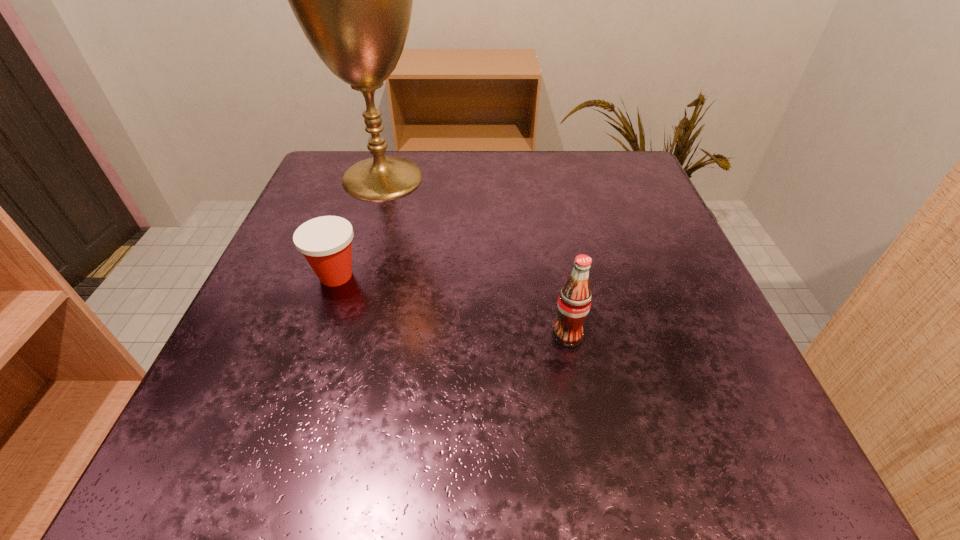
Find the location of `empty space between the farthest object and the soda`. empty space between the farthest object and the soda is located at coordinates (475, 256).

Identify the location of unoccupied position between the second tallest object and the trophy cup. (475, 256).

This screenshot has height=540, width=960. What are the coordinates of `vacant point located between the Dixie cup and the nearest object` in the screenshot? It's located at pyautogui.click(x=451, y=306).

Locate an element on the screen. vacant space in between the nearest object and the farthest object is located at coordinates (475, 256).

Locate an element on the screen. The height and width of the screenshot is (540, 960). free space between the second farthest object and the rightmost object is located at coordinates (451, 306).

Locate an element on the screen. free space that is in between the nearest object and the second nearest object is located at coordinates (451, 306).

Locate an element on the screen. free space that is in between the Dixie cup and the second shortest object is located at coordinates (451, 306).

Find the location of `unoccupied area between the tallest object and the second nearest object`. unoccupied area between the tallest object and the second nearest object is located at coordinates (359, 227).

Where is `free space between the shortest object and the trophy cup`? Image resolution: width=960 pixels, height=540 pixels. free space between the shortest object and the trophy cup is located at coordinates (359, 227).

Identify the location of object that is the second nearest to the second nearest object. (574, 302).